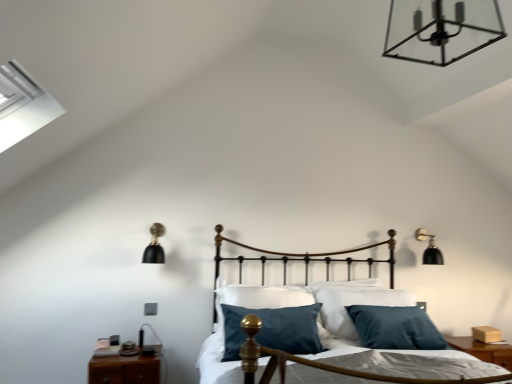
This screenshot has width=512, height=384. I want to click on metal/transparent glass chandelier at upper center, which is the 3th lamp in back-to-front order, so click(x=441, y=29).

At what (x,y) coordinates should I click in order to perform the action: click on gold polished metal bed frame at center. Please return your answer as a coordinate pair (x, y). Image resolution: width=512 pixels, height=384 pixels. Looking at the image, I should click on (409, 362).

Describe the element at coordinates (155, 246) in the screenshot. I see `black matte wall sconce at left, which is counted as the 2th lamp, starting from the front` at that location.

Image resolution: width=512 pixels, height=384 pixels. What do you see at coordinates (483, 350) in the screenshot?
I see `brown wood nightstand at lower right, the 2th nightstand from the left` at bounding box center [483, 350].

Where is `metal/transparent glass chandelier at upper center, the first lamp when ordered from top to bottom`? metal/transparent glass chandelier at upper center, the first lamp when ordered from top to bottom is located at coordinates pyautogui.click(x=441, y=29).

Can you confirm if brown wood nightstand at lower left, the second nightstand positioned from the right, is smaller than brown wood nightstand at lower right, which is counted as the 1th nightstand, starting from the right?

No, brown wood nightstand at lower left, the second nightstand positioned from the right, is not smaller than brown wood nightstand at lower right, which is counted as the 1th nightstand, starting from the right.

Is brown wood nightstand at lower left, which ranks as the first nightstand in front-to-back order, taller or shorter than brown wood nightstand at lower right, the 2th nightstand from the left?

Considering their sizes, brown wood nightstand at lower left, which ranks as the first nightstand in front-to-back order, has more height than brown wood nightstand at lower right, the 2th nightstand from the left.

Is brown wood nightstand at lower left, positioned as the 1th nightstand in left-to-right order, in front of brown wood nightstand at lower right, the 2th nightstand from the left?

Yes, brown wood nightstand at lower left, positioned as the 1th nightstand in left-to-right order, is closer to the camera.

Considering the positions of point (112, 361) and point (455, 339), is point (112, 361) closer or farther from the camera than point (455, 339)?

Point (112, 361) appears to be closer to the viewer than point (455, 339).

How far apart are black matte wall sconce at left, positioned as the first lamp in left-to-right order, and metal/transparent glass chandelier at upper center, the 3th lamp positioned from the bottom?

black matte wall sconce at left, positioned as the first lamp in left-to-right order, is 2.20 meters away from metal/transparent glass chandelier at upper center, the 3th lamp positioned from the bottom.

From the picture: In terms of height, does black matte wall sconce at left, positioned as the 2th lamp in bottom-to-top order, look taller or shorter compared to metal/transparent glass chandelier at upper center, the first lamp when ordered from top to bottom?

black matte wall sconce at left, positioned as the 2th lamp in bottom-to-top order, is taller than metal/transparent glass chandelier at upper center, the first lamp when ordered from top to bottom.

From the image's perspective, is black matte wall sconce at left, positioned as the first lamp in left-to-right order, above metal/transparent glass chandelier at upper center, the 3th lamp positioned from the bottom?

Actually, black matte wall sconce at left, positioned as the first lamp in left-to-right order, appears below metal/transparent glass chandelier at upper center, the 3th lamp positioned from the bottom, in the image.

Could you tell me if black matte wall sconce at left, positioned as the 2th lamp in bottom-to-top order, is turned towards metal/transparent glass chandelier at upper center, which appears as the first lamp when viewed from the front?

No, black matte wall sconce at left, positioned as the 2th lamp in bottom-to-top order, is not facing towards metal/transparent glass chandelier at upper center, which appears as the first lamp when viewed from the front.

From the brown wood nightstand at lower left, the second nightstand positioned from the right, count 3rd lamp to the right and point to it. Please provide its 2D coordinates.

[(429, 248)]

Considering the points (126, 367) and (433, 242), which point is behind, point (126, 367) or point (433, 242)?

Positioned behind is point (433, 242).

From the picture: Is brown wood nightstand at lower left, the second nightstand positioned from the right, positioned in front of black matte wall sconce at right, positioned as the 3th lamp in top-to-bottom order?

Yes, it is in front of black matte wall sconce at right, positioned as the 3th lamp in top-to-bottom order.

Considering the sizes of objects brown wood nightstand at lower left, which ranks as the first nightstand in front-to-back order, and black matte wall sconce at right, the 1th lamp positioned from the right, in the image provided, who is taller, brown wood nightstand at lower left, which ranks as the first nightstand in front-to-back order, or black matte wall sconce at right, the 1th lamp positioned from the right,?

black matte wall sconce at right, the 1th lamp positioned from the right, is taller.

Are metal/transparent glass chandelier at upper center, which is the 3th lamp in back-to-front order, and black matte wall sconce at right, which ranks as the 3th lamp in front-to-back order, beside each other?

No, metal/transparent glass chandelier at upper center, which is the 3th lamp in back-to-front order, is not touching black matte wall sconce at right, which ranks as the 3th lamp in front-to-back order.

In the scene shown: Can you tell me how much metal/transparent glass chandelier at upper center, which is the 3th lamp in back-to-front order, and black matte wall sconce at right, which ranks as the 3th lamp in front-to-back order, differ in facing direction?

metal/transparent glass chandelier at upper center, which is the 3th lamp in back-to-front order, and black matte wall sconce at right, which ranks as the 3th lamp in front-to-back order, are facing 0.00043 degrees away from each other.

Is metal/transparent glass chandelier at upper center, the first lamp when ordered from top to bottom, wider or thinner than black matte wall sconce at right, positioned as the 3th lamp in left-to-right order?

In the image, metal/transparent glass chandelier at upper center, the first lamp when ordered from top to bottom, appears to be wider than black matte wall sconce at right, positioned as the 3th lamp in left-to-right order.

From a real-world perspective, is metal/transparent glass chandelier at upper center, the first lamp when ordered from top to bottom, located beneath black matte wall sconce at right, the 1th lamp positioned from the right?

No, from a real-world perspective, metal/transparent glass chandelier at upper center, the first lamp when ordered from top to bottom, is not under black matte wall sconce at right, the 1th lamp positioned from the right.

From a real-world perspective, is black matte wall sconce at right, which ranks as the 3th lamp in front-to-back order, on metal/transparent glass chandelier at upper center, which appears as the first lamp when viewed from the front?

Actually, black matte wall sconce at right, which ranks as the 3th lamp in front-to-back order, is physically below metal/transparent glass chandelier at upper center, which appears as the first lamp when viewed from the front, in the real world.

Considering the sizes of black matte wall sconce at right, which ranks as the 3th lamp in front-to-back order, and metal/transparent glass chandelier at upper center, which appears as the first lamp when viewed from the front, in the image, is black matte wall sconce at right, which ranks as the 3th lamp in front-to-back order, wider or thinner than metal/transparent glass chandelier at upper center, which appears as the first lamp when viewed from the front,?

In the image, black matte wall sconce at right, which ranks as the 3th lamp in front-to-back order, appears to be more narrow than metal/transparent glass chandelier at upper center, which appears as the first lamp when viewed from the front.

Considering the points (432, 257) and (426, 11), which point is behind, point (432, 257) or point (426, 11)?

The point (432, 257) is more distant.

Is black matte wall sconce at right, which ranks as the 3th lamp in front-to-back order, bigger than metal/transparent glass chandelier at upper center, the second lamp viewed from the left?

Actually, black matte wall sconce at right, which ranks as the 3th lamp in front-to-back order, might be smaller than metal/transparent glass chandelier at upper center, the second lamp viewed from the left.

Is brown wood nightstand at lower left, positioned as the 1th nightstand in left-to-right order, in front of gold polished metal bed frame at center?

No, it is behind gold polished metal bed frame at center.

Which of these two, brown wood nightstand at lower left, positioned as the 1th nightstand in left-to-right order, or gold polished metal bed frame at center, stands shorter?

Standing shorter between the two is brown wood nightstand at lower left, positioned as the 1th nightstand in left-to-right order.

Does point (116, 368) appear closer or farther from the camera than point (426, 351)?

Clearly, point (116, 368) is more distant from the camera than point (426, 351).

From the image's perspective, would you say brown wood nightstand at lower left, which ranks as the first nightstand in front-to-back order, is positioned over gold polished metal bed frame at center?

No, from the image's perspective, brown wood nightstand at lower left, which ranks as the first nightstand in front-to-back order, is not over gold polished metal bed frame at center.

Does point (482, 348) come farther from viewer compared to point (425, 240)?

No, it is not.

Is brown wood nightstand at lower right, which is counted as the 1th nightstand, starting from the right, positioned beyond the bounds of black matte wall sconce at right, the 1th lamp in the back-to-front sequence?

Absolutely, brown wood nightstand at lower right, which is counted as the 1th nightstand, starting from the right, is external to black matte wall sconce at right, the 1th lamp in the back-to-front sequence.

Is brown wood nightstand at lower right, placed as the first nightstand when sorted from back to front, turned away from black matte wall sconce at right, the 1th lamp positioned from the right?

That's not correct — brown wood nightstand at lower right, placed as the first nightstand when sorted from back to front, is not looking away from black matte wall sconce at right, the 1th lamp positioned from the right.

Is brown wood nightstand at lower right, the 2th nightstand from the front, shorter than black matte wall sconce at right, the 1th lamp in the back-to-front sequence?

Yes.

Image resolution: width=512 pixels, height=384 pixels. In order to click on nightstand above the brown wood nightstand at lower left, which ranks as the first nightstand in front-to-back order (from a real-world perspective) in this screenshot , I will do `click(483, 350)`.

From the image's perspective, which lamp is the 1st one below the metal/transparent glass chandelier at upper center, the first lamp when ordered from top to bottom? Please provide its 2D coordinates.

[(155, 246)]

From the image, which object appears to be farther from black matte wall sconce at left, which is counted as the 2th lamp, starting from the front, gold polished metal bed frame at center or black matte wall sconce at right, positioned as the 3th lamp in left-to-right order?

black matte wall sconce at right, positioned as the 3th lamp in left-to-right order, is further to black matte wall sconce at left, which is counted as the 2th lamp, starting from the front.

When comparing their distances from black matte wall sconce at right, the 1th lamp in the back-to-front sequence, does brown wood nightstand at lower left, the second nightstand positioned from the right, or brown wood nightstand at lower right, which is counted as the 1th nightstand, starting from the right, seem closer?

brown wood nightstand at lower right, which is counted as the 1th nightstand, starting from the right, is positioned closer to the anchor black matte wall sconce at right, the 1th lamp in the back-to-front sequence.

From the image, which object appears to be nearer to gold polished metal bed frame at center, black matte wall sconce at left, the second lamp when ordered from top to bottom, or metal/transparent glass chandelier at upper center, the 2th lamp viewed from the right?

metal/transparent glass chandelier at upper center, the 2th lamp viewed from the right, lies closer to gold polished metal bed frame at center than the other object.

Estimate the real-world distances between objects in this image. Which object is further from black matte wall sconce at right, placed as the 1th lamp when sorted from bottom to top, brown wood nightstand at lower left, positioned as the 2th nightstand in back-to-front order, or metal/transparent glass chandelier at upper center, the second lamp viewed from the left?

Among the two, brown wood nightstand at lower left, positioned as the 2th nightstand in back-to-front order, is located further to black matte wall sconce at right, placed as the 1th lamp when sorted from bottom to top.

When comparing their distances from brown wood nightstand at lower right, the 2th nightstand from the left, does gold polished metal bed frame at center or brown wood nightstand at lower left, positioned as the 2th nightstand in back-to-front order, seem closer?

gold polished metal bed frame at center.

Which object lies further to the anchor point gold polished metal bed frame at center, brown wood nightstand at lower right, the 2th nightstand from the left, or metal/transparent glass chandelier at upper center, the 3th lamp positioned from the bottom?

Based on the image, metal/transparent glass chandelier at upper center, the 3th lamp positioned from the bottom, appears to be further to gold polished metal bed frame at center.

Looking at the image, which one is located closer to gold polished metal bed frame at center, black matte wall sconce at left, marked as the third lamp in a right-to-left arrangement, or black matte wall sconce at right, the 1th lamp positioned from the right?

black matte wall sconce at right, the 1th lamp positioned from the right.

Based on their spatial positions, is gold polished metal bed frame at center or metal/transparent glass chandelier at upper center, the 3th lamp positioned from the bottom, further from black matte wall sconce at right, positioned as the 3th lamp in left-to-right order?

The object further to black matte wall sconce at right, positioned as the 3th lamp in left-to-right order, is metal/transparent glass chandelier at upper center, the 3th lamp positioned from the bottom.

Image resolution: width=512 pixels, height=384 pixels. What are the coordinates of `nightstand located between gold polished metal bed frame at center and black matte wall sconce at left, the second lamp when ordered from top to bottom, in the depth direction` in the screenshot? It's located at [x=125, y=368].

Identify the location of bed frame between black matte wall sconce at left, which is counted as the 2th lamp, starting from the front, and black matte wall sconce at right, the 1th lamp in the back-to-front sequence, in the horizontal direction. (409, 362).

Where is `bed frame between metal/transparent glass chandelier at upper center, which is the 3th lamp in back-to-front order, and brown wood nightstand at lower left, positioned as the 2th nightstand in back-to-front order, in the up-down direction`? The height and width of the screenshot is (384, 512). bed frame between metal/transparent glass chandelier at upper center, which is the 3th lamp in back-to-front order, and brown wood nightstand at lower left, positioned as the 2th nightstand in back-to-front order, in the up-down direction is located at coordinates (409, 362).

Where is `lamp between black matte wall sconce at left, marked as the third lamp in a right-to-left arrangement, and black matte wall sconce at right, positioned as the 3th lamp in top-to-bottom order, from left to right`? This screenshot has height=384, width=512. lamp between black matte wall sconce at left, marked as the third lamp in a right-to-left arrangement, and black matte wall sconce at right, positioned as the 3th lamp in top-to-bottom order, from left to right is located at coordinates (441, 29).